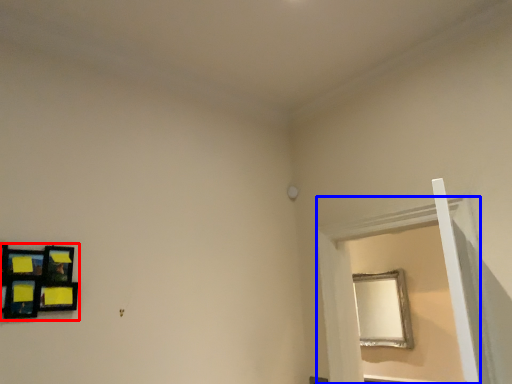
Question: Among these objects, which one is farthest to the camera, picture frame (highlighted by a red box) or window frame (highlighted by a blue box)?

Choices:
 (A) picture frame
 (B) window frame

Answer: (B)